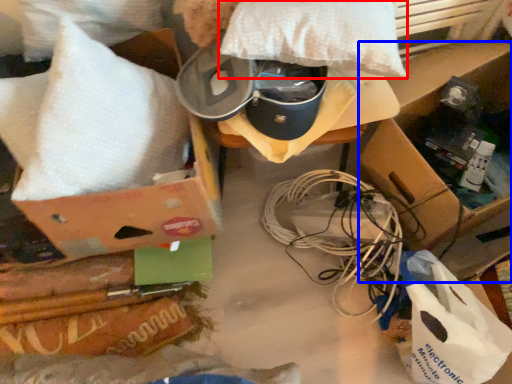
Question: Which of the following is the farthest to the observer, pillow (highlighted by a red box) or cardboard box (highlighted by a blue box)?

Choices:
 (A) pillow
 (B) cardboard box

Answer: (B)